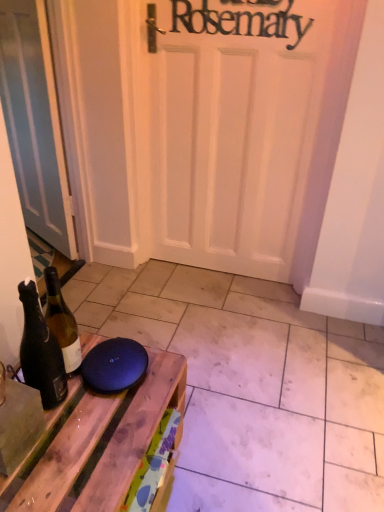
The width and height of the screenshot is (384, 512). What do you see at coordinates (253, 386) in the screenshot?
I see `matte wood tile at lower center` at bounding box center [253, 386].

Image resolution: width=384 pixels, height=512 pixels. What are the coordinates of `dark brown glass bottle at left` in the screenshot? It's located at (40, 351).

Find the location of a particular element. matte white door at left is located at coordinates (34, 123).

The width and height of the screenshot is (384, 512). Describe the element at coordinates (97, 443) in the screenshot. I see `wooden table at lower left` at that location.

Locate an element on the screen. wooden table at lower left is located at coordinates (97, 443).

You are a GUI agent. You are given a task and a screenshot of the screen. Output one action in this format:
    pyautogui.click(x=<x>, y=<y>)
    Task: Click on the matte wood tile at lower center
    
    Given the screenshot: What is the action you would take?
    coord(253,386)

Looking at this image, is matte wood tile at lower center oriented away from wooden table at lower left?

matte wood tile at lower center is not turned away from wooden table at lower left.

From the picture: From a real-world perspective, is matte wood tile at lower center located higher than wooden table at lower left?

No.

Is matte wood tile at lower center bigger or smaller than wooden table at lower left?

matte wood tile at lower center is bigger than wooden table at lower left.

Is matte wood tile at lower center completely or partially outside of wooden table at lower left?

matte wood tile at lower center is positioned outside wooden table at lower left.

Which point is more distant from viewer, [27,308] or [38,49]?

The point [38,49] is farther from the camera.

From a real-world perspective, is dark brown glass bottle at left positioned over matte white door at left based on gravity?

No, from a real-world perspective, dark brown glass bottle at left is not on top of matte white door at left.

Is dark brown glass bottle at left inside or outside of matte white door at left?

dark brown glass bottle at left is not inside matte white door at left, it's outside.

Considering the positions of objects wooden table at lower left and dark brown glass bottle at left in the image provided, who is behind, wooden table at lower left or dark brown glass bottle at left?

dark brown glass bottle at left is more distant.

Is wooden table at lower left next to dark brown glass bottle at left and touching it?

No, wooden table at lower left is not next to dark brown glass bottle at left.

You are a GUI agent. You are given a task and a screenshot of the screen. Output one action in this format:
    pyautogui.click(x=<x>, y=<y>)
    Task: Click on the bottle above the wooden table at lower left (from a real-world perspective)
    The image size is (384, 512).
    Given the screenshot: What is the action you would take?
    pyautogui.click(x=40, y=351)

Is wooden table at lower left looking in the opposite direction of dark brown glass bottle at left?

No, wooden table at lower left is not facing the opposite direction of dark brown glass bottle at left.

In the scene shown: Looking at the image, does matte white door at left seem bigger or smaller compared to dark brown glass bottle at left?

Clearly, matte white door at left is larger in size than dark brown glass bottle at left.

Does matte white door at left touch dark brown glass bottle at left?

No, matte white door at left is not making contact with dark brown glass bottle at left.

From a real-world perspective, is matte white door at left positioned under dark brown glass bottle at left based on gravity?

No.

Which object is positioned more to the left, dark brown glass bottle at left or matte wood tile at lower center?

Positioned to the left is dark brown glass bottle at left.

Is dark brown glass bottle at left wider or thinner than matte wood tile at lower center?

dark brown glass bottle at left is thinner than matte wood tile at lower center.

Could matte wood tile at lower center be considered to be inside dark brown glass bottle at left?

No, matte wood tile at lower center is not a part of dark brown glass bottle at left.

From a real-world perspective, is matte wood tile at lower center positioned over matte white door at left based on gravity?

No, from a real-world perspective, matte wood tile at lower center is not over matte white door at left

From the picture: From the image's perspective, is matte wood tile at lower center located beneath matte white door at left?

Correct, matte wood tile at lower center appears lower than matte white door at left in the image.

Which is less distant, (317, 362) or (10, 102)?

Point (317, 362)

In the scene shown: Is matte wood tile at lower center oriented away from matte white door at left?

No, matte white door at left is not at the back of matte wood tile at lower center.

Looking at this image, from the image's perspective, which is below, matte white door at left or matte wood tile at lower center?

matte wood tile at lower center, from the image's perspective.

From the picture: Between matte white door at left and matte wood tile at lower center, which one is positioned in front?

matte wood tile at lower center is in front.

In the scene shown: Is matte white door at left positioned far away from matte wood tile at lower center?

No.

Find the location of a particular element. The width and height of the screenshot is (384, 512). door that appears behind the matte wood tile at lower center is located at coordinates (34, 123).

The width and height of the screenshot is (384, 512). Identify the location of table above the matte wood tile at lower center (from a real-world perspective). (97, 443).

The width and height of the screenshot is (384, 512). What are the coordinates of `bottle below the matte white door at left (from a real-world perspective)` in the screenshot? It's located at pyautogui.click(x=40, y=351).

Which object lies further to the anchor point matte wood tile at lower center, wooden table at lower left or matte white door at left?

matte white door at left.

From the image, which object appears to be farther from wooden table at lower left, dark brown glass bottle at left or matte white door at left?

Based on the image, matte white door at left appears to be further to wooden table at lower left.

Based on their spatial positions, is matte white door at left or dark brown glass bottle at left closer to wooden table at lower left?

Based on the image, dark brown glass bottle at left appears to be nearer to wooden table at lower left.

Considering their positions, is matte wood tile at lower center positioned further to wooden table at lower left than matte white door at left?

Among the two, matte white door at left is located further to wooden table at lower left.

Looking at the image, which one is located further to dark brown glass bottle at left, matte white door at left or matte wood tile at lower center?

Based on the image, matte white door at left appears to be further to dark brown glass bottle at left.

When comparing their distances from matte white door at left, does matte wood tile at lower center or dark brown glass bottle at left seem closer?

Based on the image, matte wood tile at lower center appears to be nearer to matte white door at left.

Looking at the image, which one is located closer to matte white door at left, dark brown glass bottle at left or matte wood tile at lower center?

matte wood tile at lower center.

Looking at the image, which one is located further to matte wood tile at lower center, dark brown glass bottle at left or matte white door at left?

The object further to matte wood tile at lower center is matte white door at left.

Image resolution: width=384 pixels, height=512 pixels. I want to click on tile between matte white door at left and wooden table at lower left from top to bottom, so click(x=253, y=386).

Image resolution: width=384 pixels, height=512 pixels. In order to click on bottle between matte white door at left and wooden table at lower left from top to bottom in this screenshot , I will do `click(40, 351)`.

This screenshot has height=512, width=384. Identify the location of bottle between matte white door at left and matte wood tile at lower center vertically. (40, 351).

This screenshot has height=512, width=384. What are the coordinates of `table situated between dark brown glass bottle at left and matte wood tile at lower center from left to right` in the screenshot? It's located at (97, 443).